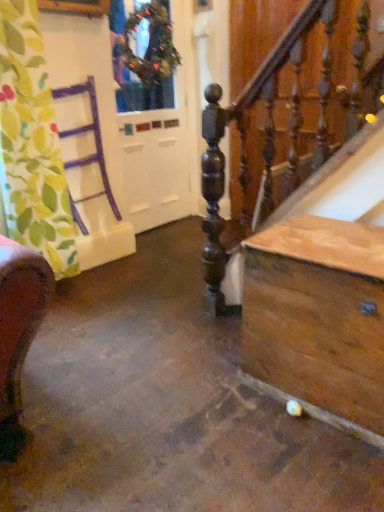
This screenshot has height=512, width=384. What do you see at coordinates (143, 56) in the screenshot?
I see `green textured wreath at upper center` at bounding box center [143, 56].

Measure the distance between point [354,377] and camera.

A distance of 1.40 meters exists between point [354,377] and camera.

Where is `white glossy door at upper left`? The image size is (384, 512). white glossy door at upper left is located at coordinates (150, 111).

Is green leafy fabric at left inside or outside of wooden chest at lower right?

green leafy fabric at left exists outside the volume of wooden chest at lower right.

Is point (61, 193) positioned after point (343, 344)?

Yes, point (61, 193) is behind point (343, 344).

From a real-world perspective, is green leafy fabric at left beneath wooden chest at lower right?

No.

Consider the image. From the image's perspective, between green textured wreath at upper center and wooden chest at lower right, who is located below?

wooden chest at lower right is shown below in the image.

Is green textured wreath at upper center placed right next to wooden chest at lower right?

No, green textured wreath at upper center is not in contact with wooden chest at lower right.

In terms of width, does green textured wreath at upper center look wider or thinner when compared to wooden chest at lower right?

In the image, green textured wreath at upper center appears to be more narrow than wooden chest at lower right.

From the picture: Between green textured wreath at upper center and wooden chest at lower right, which one has less height?

wooden chest at lower right is shorter.

Looking at this image, is white glossy door at upper left not inside green textured wreath at upper center?

Yes, white glossy door at upper left is outside of green textured wreath at upper center.

Is white glossy door at upper left to the left of green textured wreath at upper center from the viewer's perspective?

Correct, you'll find white glossy door at upper left to the left of green textured wreath at upper center.

How different are the orientations of white glossy door at upper left and green textured wreath at upper center in degrees?

There is a 2.05-degree angle between the facing directions of white glossy door at upper left and green textured wreath at upper center.

Is green leafy fabric at left directly adjacent to white glossy door at upper left?

No, green leafy fabric at left is not with white glossy door at upper left.

Considering the relative sizes of green leafy fabric at left and white glossy door at upper left in the image provided, is green leafy fabric at left bigger than white glossy door at upper left?

Indeed, green leafy fabric at left has a larger size compared to white glossy door at upper left.

Looking at this image, between green leafy fabric at left and white glossy door at upper left, which one appears on the right side from the viewer's perspective?

white glossy door at upper left is more to the right.

From the image's perspective, is green leafy fabric at left below white glossy door at upper left?

Yes, from the image's perspective, green leafy fabric at left is beneath white glossy door at upper left.

Which object is positioned more to the left, white glossy door at upper left or green leafy fabric at left?

green leafy fabric at left.

Image resolution: width=384 pixels, height=512 pixels. What are the coordinates of `curtain that appears on the left of white glossy door at upper left` in the screenshot? It's located at (32, 143).

Considering the points (352, 315) and (166, 13), which point is behind, point (352, 315) or point (166, 13)?

The point (166, 13) is behind.

What's the angular difference between wooden chest at lower right and white glossy door at upper left's facing directions?

wooden chest at lower right and white glossy door at upper left are facing 86.9 degrees away from each other.

In the image, is wooden chest at lower right on the left side or the right side of white glossy door at upper left?

wooden chest at lower right is to the right of white glossy door at upper left.

Could you tell me if wooden chest at lower right is turned towards white glossy door at upper left?

No.

Can you tell me how much green textured wreath at upper center and green leafy fabric at left differ in facing direction?

7.37 degrees.

From the image's perspective, does green textured wreath at upper center appear lower than green leafy fabric at left?

Actually, green textured wreath at upper center appears above green leafy fabric at left in the image.

Between green textured wreath at upper center and green leafy fabric at left, which one is positioned in front?

green leafy fabric at left is in front.

You are a GUI agent. You are given a task and a screenshot of the screen. Output one action in this format:
    pyautogui.click(x=<x>, y=<y>)
    Task: Click on the curtain on the left side of green textured wreath at upper center
    This screenshot has height=512, width=384.
    Given the screenshot: What is the action you would take?
    (32, 143)

The width and height of the screenshot is (384, 512). Find the location of `curtain on the left side of wooden chest at lower right`. curtain on the left side of wooden chest at lower right is located at coordinates (32, 143).

Locate an element on the screen. This screenshot has width=384, height=512. table that is on the right side of green textured wreath at upper center is located at coordinates (318, 319).

From the image, which object appears to be farther from green leafy fabric at left, wooden chest at lower right or white glossy door at upper left?

Based on the image, wooden chest at lower right appears to be further to green leafy fabric at left.

Looking at the image, which one is located closer to white glossy door at upper left, green textured wreath at upper center or wooden chest at lower right?

green textured wreath at upper center.

When comparing their distances from green leafy fabric at left, does green textured wreath at upper center or white glossy door at upper left seem closer?

The object closer to green leafy fabric at left is green textured wreath at upper center.

From the image, which object appears to be nearer to white glossy door at upper left, wooden chest at lower right or green leafy fabric at left?

Based on the image, green leafy fabric at left appears to be nearer to white glossy door at upper left.

Estimate the real-world distances between objects in this image. Which object is further from green textured wreath at upper center, wooden chest at lower right or white glossy door at upper left?

wooden chest at lower right.

Looking at the image, which one is located further to green leafy fabric at left, white glossy door at upper left or wooden chest at lower right?

The object further to green leafy fabric at left is wooden chest at lower right.

From the image, which object appears to be farther from green textured wreath at upper center, white glossy door at upper left or green leafy fabric at left?

green leafy fabric at left is further to green textured wreath at upper center.

Looking at the image, which one is located further to green leafy fabric at left, white glossy door at upper left or green textured wreath at upper center?

The object further to green leafy fabric at left is white glossy door at upper left.

What are the coordinates of `curtain between green textured wreath at upper center and wooden chest at lower right vertically` in the screenshot? It's located at (32, 143).

Locate an element on the screen. The height and width of the screenshot is (512, 384). curtain between wooden chest at lower right and white glossy door at upper left from front to back is located at coordinates (32, 143).

This screenshot has height=512, width=384. In order to click on window between green leafy fabric at left and white glossy door at upper left along the z-axis in this screenshot , I will do [143, 56].

Image resolution: width=384 pixels, height=512 pixels. In order to click on screen door between green textured wreath at upper center and wooden chest at lower right vertically in this screenshot , I will do `click(150, 111)`.